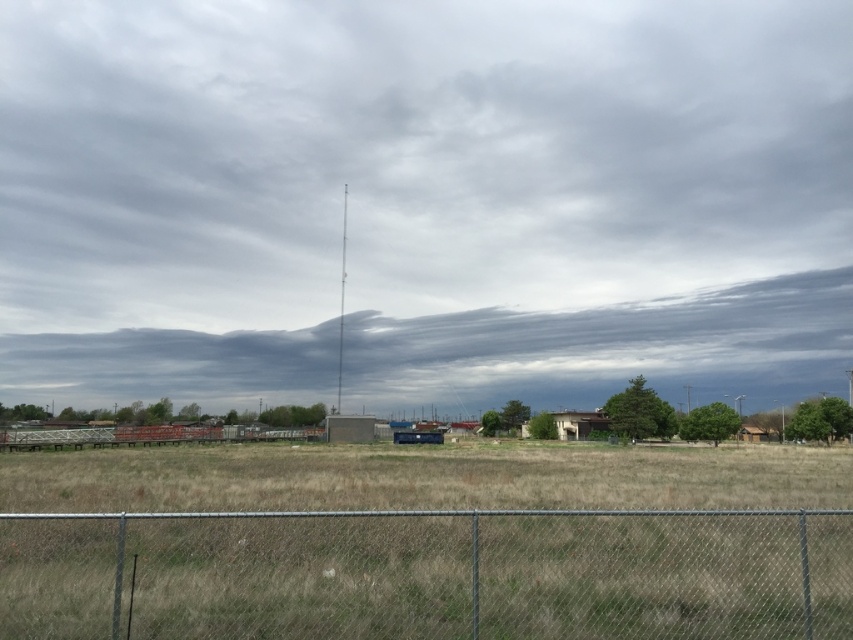
Is gray cloudy sky at center thinner than smooth concrete pole at center?

No.

Is point (532, 352) less distant than point (341, 268)?

No, (532, 352) is further to viewer.

Is point (805, 49) farther from camera compared to point (343, 266)?

Yes, it is.

Locate an element on the screen. gray cloudy sky at center is located at coordinates (424, 202).

Is point (840, 545) more distant than point (788, 307)?

No, it is in front of (788, 307).

Locate an element on the screen. This screenshot has width=853, height=640. metal chain-link fence at lower center is located at coordinates (428, 573).

Locate an element on the screen. Image resolution: width=853 pixels, height=640 pixels. metal chain-link fence at lower center is located at coordinates (428, 573).

Which is in front, point (178, 381) or point (340, 378)?

Point (340, 378) is more forward.

What do you see at coordinates (611, 348) in the screenshot?
I see `gray/cloudy sky at center` at bounding box center [611, 348].

Locate an element on the screen. This screenshot has width=853, height=640. gray/cloudy sky at center is located at coordinates (611, 348).